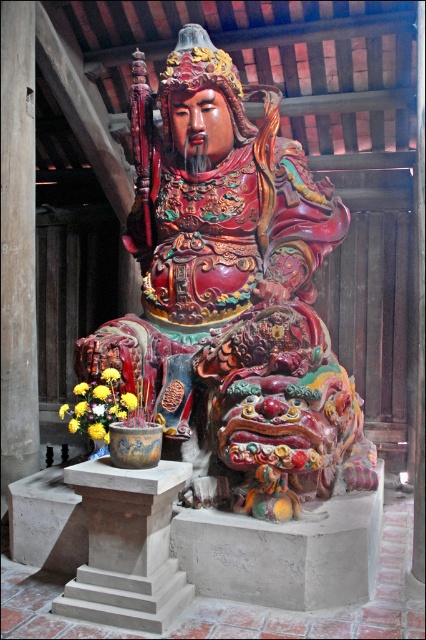
Can you confirm if glossy painted wood statue at center is positioned above gray concrete pedestal at lower left?

Yes.

Does glossy painted wood statue at center have a smaller size compared to gray concrete pedestal at lower left?

No, glossy painted wood statue at center is not smaller than gray concrete pedestal at lower left.

Is point (261, 310) positioned before point (163, 504)?

No, (261, 310) is behind (163, 504).

I want to click on glossy painted wood statue at center, so click(x=233, y=291).